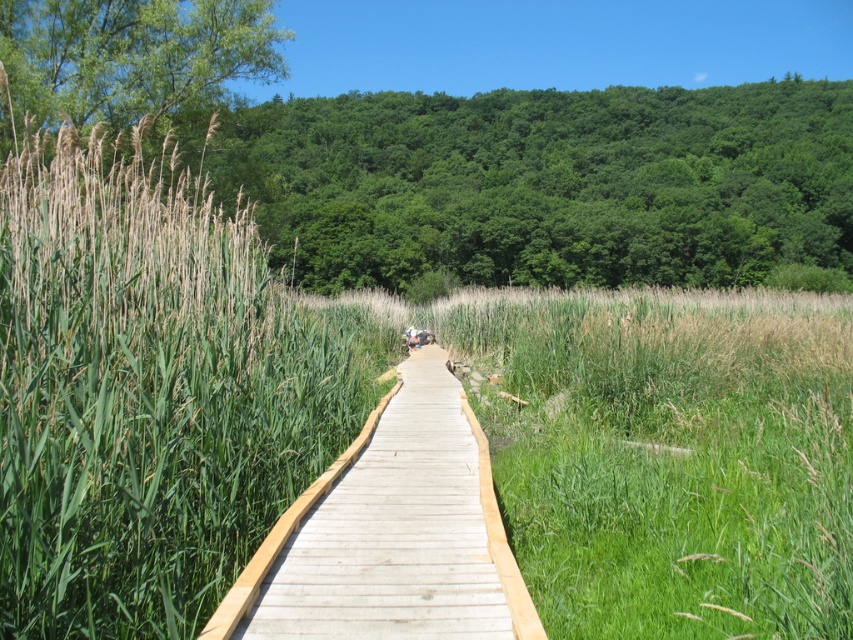
You are standing at the start of the boardwalk and want to reach a birdhouse located 10 meters away from the wooden boardwalk at center. Can you walk straight ahead from your current position to reach the birdhouse without crossing the green grass at center?

The green grass at center is 8.85 meters away from the wooden boardwalk at center. Since the birdhouse is 10 meters away from the wooden boardwalk at center, you would have to walk past the green grass at center, which is only 8.85 meters away. Therefore, you would need to cross the green grass at center to reach the birdhouse.

You are standing at the point marked as point (x=663, y=451) in the image. Which direction should you walk to reach the wooden boardwalk?

The point (x=663, y=451) is on green grass at center. To reach the wooden boardwalk, you should walk towards the left side since the boardwalk is bordered by a wooden railing on its left side and the point is located on the green grass at the center, which is adjacent to the boardwalk area.